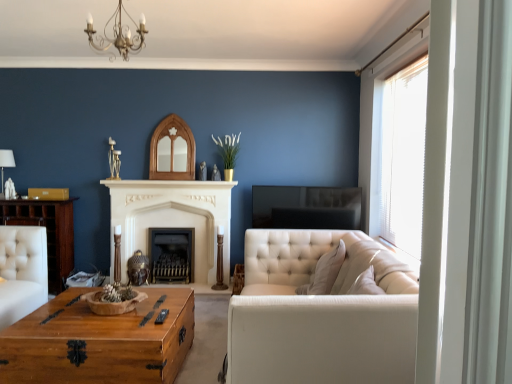
Question: From a real-world perspective, is white stone fireplace at center, which ranks as the second fireplace in back-to-front order, positioned above or below wooden coffee table at center?

Choices:
 (A) above
 (B) below

Answer: (A)

Question: Is point (214, 221) positioned closer to the camera than point (16, 367)?

Choices:
 (A) farther
 (B) closer

Answer: (A)

Question: Which is farther from the white stone fireplace at center, which ranks as the second fireplace in back-to-front order?

Choices:
 (A) white fabric couch at right
 (B) wooden trunk at left
 (C) black metal fireplace at center, positioned as the first fireplace in back-to-front order
 (D) wooden coffee table at center
 (E) white fabric lampshade at left

Answer: (D)

Question: Which is nearer to the gold metallic chandelier at upper center?

Choices:
 (A) wooden coffee table at center
 (B) white fabric lampshade at left
 (C) black metal fireplace at center, positioned as the first fireplace in back-to-front order
 (D) wooden trunk at left
 (E) white stone fireplace at center, the 1th fireplace from the front

Answer: (B)